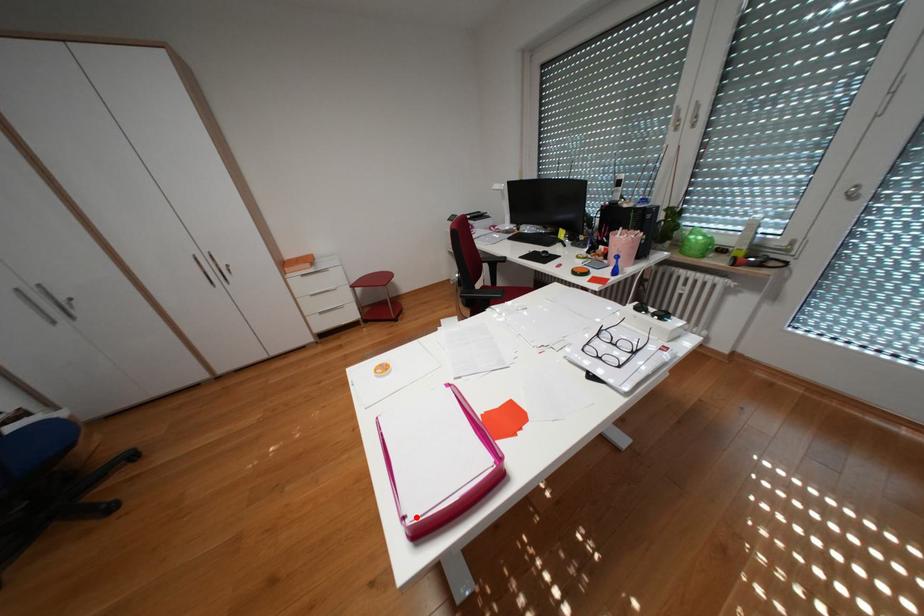
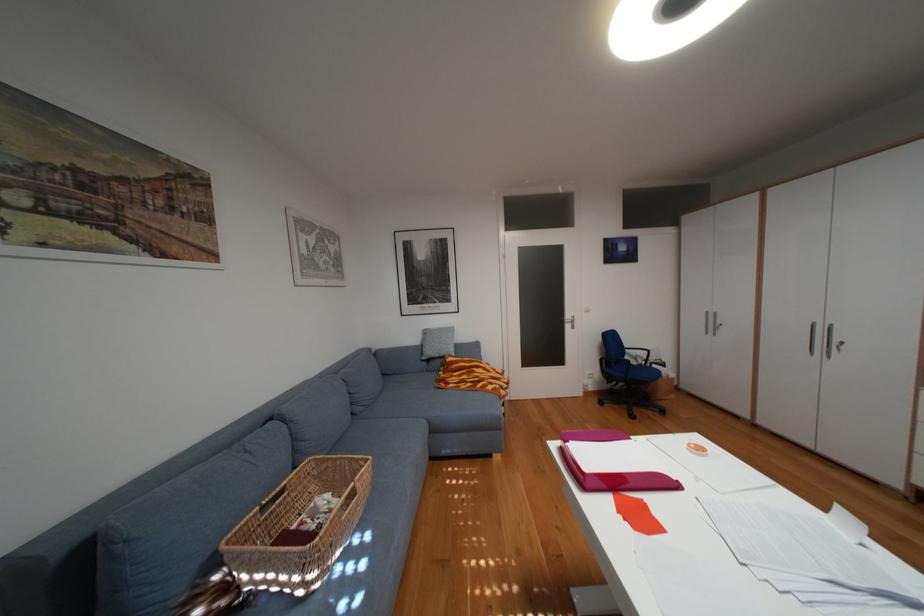
In the second image, find the point that corresponds to the highlighted location in the first image.

(581, 443)